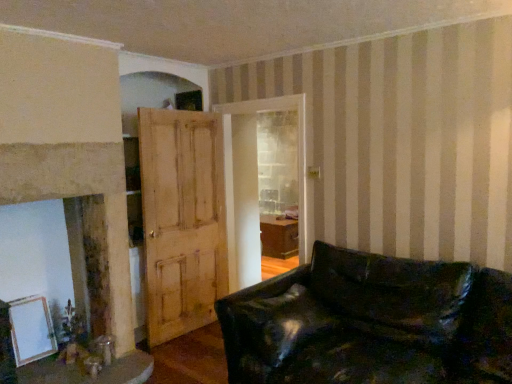
What is the approximate width of wooden table at lower left?

The width of wooden table at lower left is 30.37 inches.

Describe the element at coordinates (31, 329) in the screenshot. I see `white matte picture frame at lower left` at that location.

In order to face light brown wooden door at center, should I rotate leftwards or rightwards?

To align with it, rotate left about 9.005°.

The width and height of the screenshot is (512, 384). What do you see at coordinates (73, 162) in the screenshot?
I see `smooth beige fireplace at left` at bounding box center [73, 162].

Where is `wooden table at lower left`? wooden table at lower left is located at coordinates (86, 374).

How many degrees apart are the facing directions of black leather couch at lower right and wooden table at lower left?

The angular difference between black leather couch at lower right and wooden table at lower left is 89.2 degrees.

Would you say black leather couch at lower right is outside wooden table at lower left?

Yes, black leather couch at lower right is located beyond the bounds of wooden table at lower left.

The width and height of the screenshot is (512, 384). In order to click on table below the black leather couch at lower right (from the image's perspective) in this screenshot , I will do `click(86, 374)`.

Does black leather couch at lower right have a lesser height compared to wooden table at lower left?

No.

Consider the image. Between black leather couch at lower right and smooth beige fireplace at left, which one is positioned in front?

black leather couch at lower right is more forward.

What's the angular difference between black leather couch at lower right and smooth beige fireplace at left's facing directions?

The facing directions of black leather couch at lower right and smooth beige fireplace at left are 87.9 degrees apart.

Does black leather couch at lower right have a smaller size compared to smooth beige fireplace at left?

Incorrect, black leather couch at lower right is not smaller in size than smooth beige fireplace at left.

Which is farther, (392, 261) or (90, 57)?

Point (90, 57)

Looking at this image, is white matte picture frame at lower left to the right of black leather couch at lower right from the viewer's perspective?

No, white matte picture frame at lower left is not to the right of black leather couch at lower right.

Is white matte picture frame at lower left oriented towards black leather couch at lower right?

No, white matte picture frame at lower left is not turned towards black leather couch at lower right.

From the image's perspective, is white matte picture frame at lower left located beneath black leather couch at lower right?

Indeed, from the image's perspective, white matte picture frame at lower left is shown beneath black leather couch at lower right.

Image resolution: width=512 pixels, height=384 pixels. I want to click on picture frame that is under the black leather couch at lower right (from a real-world perspective), so click(31, 329).

How much distance is there between wooden table at lower left and smooth beige fireplace at left?

A distance of 36.55 inches exists between wooden table at lower left and smooth beige fireplace at left.

Considering the positions of points (115, 367) and (85, 71), is point (115, 367) closer to camera compared to point (85, 71)?

No.

Is wooden table at lower left thinner than smooth beige fireplace at left?

No.

Are wooden table at lower left and smooth beige fireplace at left beside each other?

No, wooden table at lower left is not next to smooth beige fireplace at left.

Considering the sizes of objects white matte picture frame at lower left and wooden table at lower left in the image provided, who is bigger, white matte picture frame at lower left or wooden table at lower left?

wooden table at lower left is bigger.

Is white matte picture frame at lower left completely or partially outside of wooden table at lower left?

white matte picture frame at lower left lies outside wooden table at lower left's area.

You are a GUI agent. You are given a task and a screenshot of the screen. Output one action in this format:
    pyautogui.click(x=<x>, y=<y>)
    Task: Click on the picture frame located on the left of wooden table at lower left
    This screenshot has height=384, width=512.
    Given the screenshot: What is the action you would take?
    pyautogui.click(x=31, y=329)

How many degrees apart are the facing directions of white matte picture frame at lower left and wooden table at lower left?

The facing directions of white matte picture frame at lower left and wooden table at lower left are 3.65 degrees apart.

How many degrees apart are the facing directions of light brown wooden door at center and wooden table at lower left?

The facing directions of light brown wooden door at center and wooden table at lower left are 3.65 degrees apart.

Does light brown wooden door at center have a lesser height compared to wooden table at lower left?

No.

Between light brown wooden door at center and wooden table at lower left, which one has larger width?

Wider between the two is wooden table at lower left.

Is the surface of light brown wooden door at center in direct contact with wooden table at lower left?

No, light brown wooden door at center is not with wooden table at lower left.

Is there a large distance between black leather couch at lower right and white matte picture frame at lower left?

Yes, black leather couch at lower right and white matte picture frame at lower left are located far from each other.

Is point (361, 351) positioned before point (35, 351)?

Yes, it is.

Consider the image. Does black leather couch at lower right appear on the right side of white matte picture frame at lower left?

Yes.

Identify the location of table below the black leather couch at lower right (from the image's perspective). This screenshot has width=512, height=384. (86, 374).

You are a GUI agent. You are given a task and a screenshot of the screen. Output one action in this format:
    pyautogui.click(x=<x>, y=<y>)
    Task: Click on the fireplace above the black leather couch at lower right (from the image's perspective)
    This screenshot has height=384, width=512.
    Given the screenshot: What is the action you would take?
    pyautogui.click(x=73, y=162)

When comparing their distances from black leather couch at lower right, does wooden table at lower left or smooth beige fireplace at left seem further?

Among the two, smooth beige fireplace at left is located further to black leather couch at lower right.

Based on their spatial positions, is white matte picture frame at lower left or light brown wooden door at center further from smooth beige fireplace at left?

Among the two, white matte picture frame at lower left is located further to smooth beige fireplace at left.

Estimate the real-world distances between objects in this image. Which object is further from wooden table at lower left, smooth beige fireplace at left or white matte picture frame at lower left?

Among the two, smooth beige fireplace at left is located further to wooden table at lower left.

From the image, which object appears to be nearer to white matte picture frame at lower left, light brown wooden door at center or black leather couch at lower right?

light brown wooden door at center.

Looking at this image, which object lies nearer to the anchor point light brown wooden door at center, black leather couch at lower right or smooth beige fireplace at left?

smooth beige fireplace at left is positioned closer to the anchor light brown wooden door at center.

Looking at the image, which one is located closer to wooden table at lower left, black leather couch at lower right or light brown wooden door at center?

light brown wooden door at center.

When comparing their distances from smooth beige fireplace at left, does light brown wooden door at center or black leather couch at lower right seem further?

Based on the image, black leather couch at lower right appears to be further to smooth beige fireplace at left.

Looking at the image, which one is located further to black leather couch at lower right, smooth beige fireplace at left or wooden table at lower left?

Among the two, smooth beige fireplace at left is located further to black leather couch at lower right.

Locate an element on the screen. door located between white matte picture frame at lower left and black leather couch at lower right in the left-right direction is located at coordinates (182, 220).

The width and height of the screenshot is (512, 384). Find the location of `door between smooth beige fireplace at left and wooden table at lower left vertically`. door between smooth beige fireplace at left and wooden table at lower left vertically is located at coordinates (182, 220).

This screenshot has height=384, width=512. I want to click on fireplace located between white matte picture frame at lower left and light brown wooden door at center in the left-right direction, so click(73, 162).

The image size is (512, 384). What are the coordinates of `table between white matte picture frame at lower left and black leather couch at lower right in the horizontal direction` in the screenshot? It's located at (86, 374).